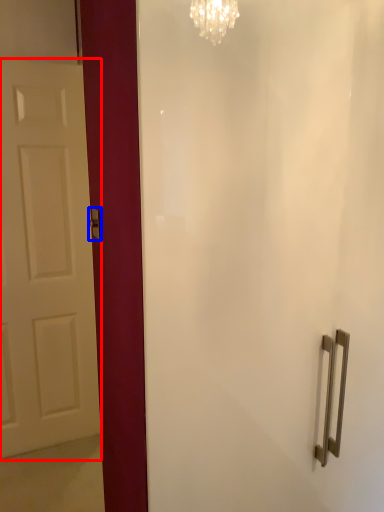
Question: Among these objects, which one is nearest to the camera, door (highlighted by a red box) or door handle (highlighted by a blue box)?

Choices:
 (A) door
 (B) door handle

Answer: (B)